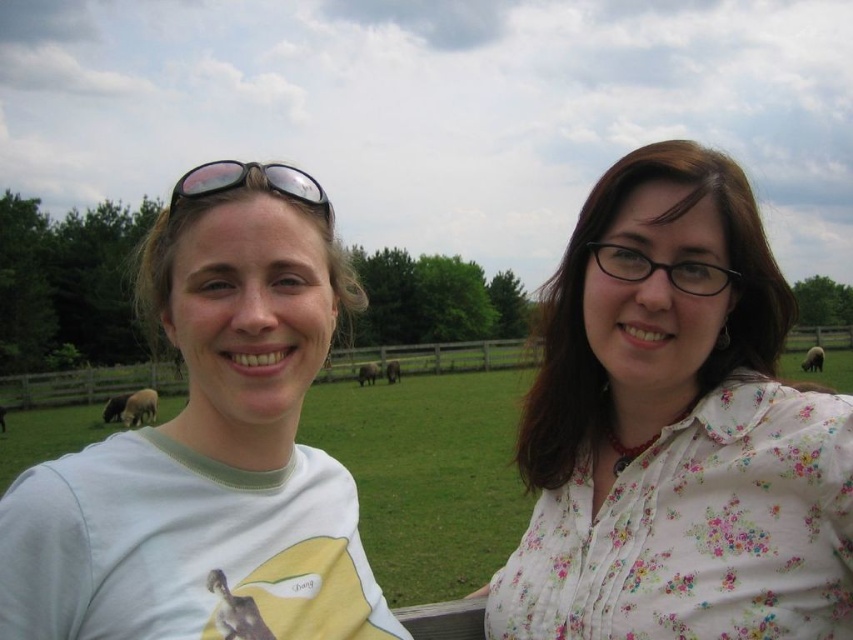
Is white cotton t-shirt at left above black reflective sunglasses at upper center?

Incorrect, white cotton t-shirt at left is not positioned above black reflective sunglasses at upper center.

In the scene shown: Who is more distant from viewer, (x=218, y=285) or (x=190, y=193)?

Positioned behind is point (x=218, y=285).

Is point (84, 545) behind point (173, 188)?

That is False.

Identify the location of white cotton t-shirt at left. (209, 449).

Can you confirm if floral cotton blouse at upper right is shorter than black reflective sunglasses at upper center?

No, floral cotton blouse at upper right is not shorter than black reflective sunglasses at upper center.

Does point (842, 518) come farther from viewer compared to point (184, 188)?

No.

I want to click on floral cotton blouse at upper right, so click(x=675, y=429).

Does point (631, 280) lie behind point (4, 580)?

Yes, point (631, 280) is behind point (4, 580).

Between point (730, 404) and point (16, 506), which one is positioned in front?

Positioned in front is point (16, 506).

You are a GUI agent. You are given a task and a screenshot of the screen. Output one action in this format:
    pyautogui.click(x=<x>, y=<y>)
    Task: Click on the floral cotton blouse at upper right
    The height and width of the screenshot is (640, 853).
    Given the screenshot: What is the action you would take?
    pyautogui.click(x=675, y=429)